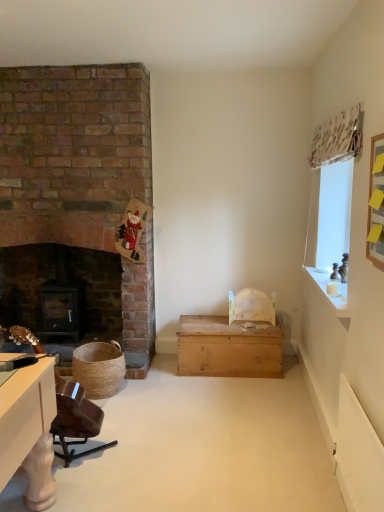
Question: Can you confirm if brown wood swivel chair at lower left is wider than dark wood fireplace at left?

Choices:
 (A) yes
 (B) no

Answer: (A)

Question: Considering the relative sizes of brown wood swivel chair at lower left and dark wood fireplace at left in the image provided, is brown wood swivel chair at lower left smaller than dark wood fireplace at left?

Choices:
 (A) no
 (B) yes

Answer: (B)

Question: Is brown wood swivel chair at lower left beside dark wood fireplace at left?

Choices:
 (A) yes
 (B) no

Answer: (B)

Question: Is brown wood swivel chair at lower left taller than dark wood fireplace at left?

Choices:
 (A) no
 (B) yes

Answer: (A)

Question: Considering the relative sizes of brown wood swivel chair at lower left and dark wood fireplace at left in the image provided, is brown wood swivel chair at lower left thinner than dark wood fireplace at left?

Choices:
 (A) yes
 (B) no

Answer: (B)

Question: Choose the correct answer: Is wooden chest at center inside brown wood swivel chair at lower left or outside it?

Choices:
 (A) inside
 (B) outside

Answer: (B)

Question: Is point (236, 347) positioned closer to the camera than point (87, 453)?

Choices:
 (A) closer
 (B) farther

Answer: (B)

Question: From the image's perspective, is wooden chest at center positioned above or below brown wood swivel chair at lower left?

Choices:
 (A) below
 (B) above

Answer: (B)

Question: In the image, is wooden chest at center positioned in front of or behind brown wood swivel chair at lower left?

Choices:
 (A) behind
 (B) front

Answer: (A)

Question: Is point click(x=339, y=308) positioned closer to the camera than point click(x=54, y=288)?

Choices:
 (A) closer
 (B) farther

Answer: (A)

Question: Is white wood candle at upper right inside the boundaries of dark wood fireplace at left, or outside?

Choices:
 (A) inside
 (B) outside

Answer: (B)

Question: From a real-world perspective, is white wood candle at upper right physically located above or below dark wood fireplace at left?

Choices:
 (A) below
 (B) above

Answer: (B)

Question: Is white wood candle at upper right wider or thinner than dark wood fireplace at left?

Choices:
 (A) wide
 (B) thin

Answer: (B)

Question: Based on their sizes in the image, would you say brown wood swivel chair at lower left is bigger or smaller than wooden chest at center?

Choices:
 (A) big
 (B) small

Answer: (B)

Question: Considering the positions of brown wood swivel chair at lower left and wooden chest at center in the image, is brown wood swivel chair at lower left wider or thinner than wooden chest at center?

Choices:
 (A) wide
 (B) thin

Answer: (B)